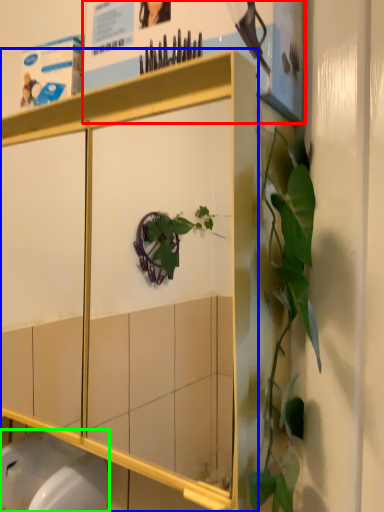
Question: Considering the real-world distances, which object is farthest from poster page (highlighted by a red box)? cabinetry (highlighted by a blue box) or toilet bowl (highlighted by a green box)?

Choices:
 (A) cabinetry
 (B) toilet bowl

Answer: (B)